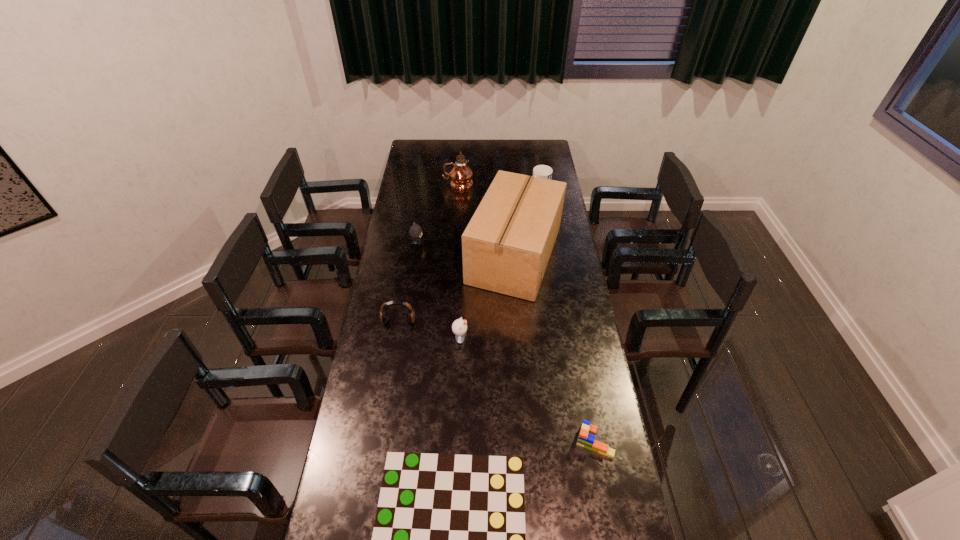
Identify the location of free space at the left edge. (360, 487).

In the image, there is a desktop. Identify the location of vacant space at the right edge. The height and width of the screenshot is (540, 960). (569, 355).

In the image, there is a desktop. At what (x,y) coordinates should I click in order to perform the action: click on vacant space at the far left corner. Please return your answer as a coordinate pair (x, y). The width and height of the screenshot is (960, 540). Looking at the image, I should click on (418, 156).

Image resolution: width=960 pixels, height=540 pixels. I want to click on vacant area that lies between the second tallest object and the headset, so click(457, 288).

In order to click on vacant area between the mug and the seventh tallest object in this screenshot , I will do `click(566, 316)`.

I want to click on vacant space in between the Lego and the second tallest object, so click(554, 348).

The height and width of the screenshot is (540, 960). In order to click on unoccupied position between the seventh tallest object and the tallest object in this screenshot , I will do `click(526, 313)`.

Image resolution: width=960 pixels, height=540 pixels. Find the location of `free space between the oil lamp and the second shortest object`. free space between the oil lamp and the second shortest object is located at coordinates pyautogui.click(x=526, y=313).

Identify the location of empty space that is in between the seventh shortest object and the fourth nearest object. (457, 288).

Find the location of a particular element. vacant region between the Lego and the farther kitten is located at coordinates (506, 342).